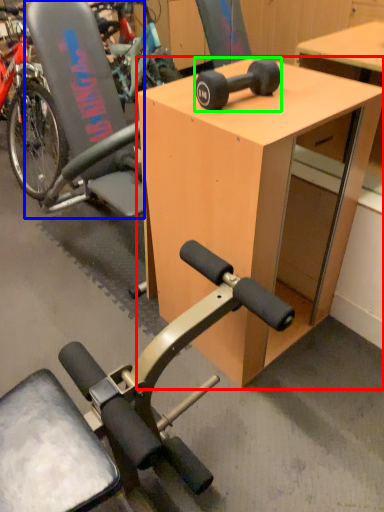
Question: Which is nearer to the desk (highlighted by a red box)? swivel chair (highlighted by a blue box) or wheel (highlighted by a green box).

Choices:
 (A) swivel chair
 (B) wheel

Answer: (B)